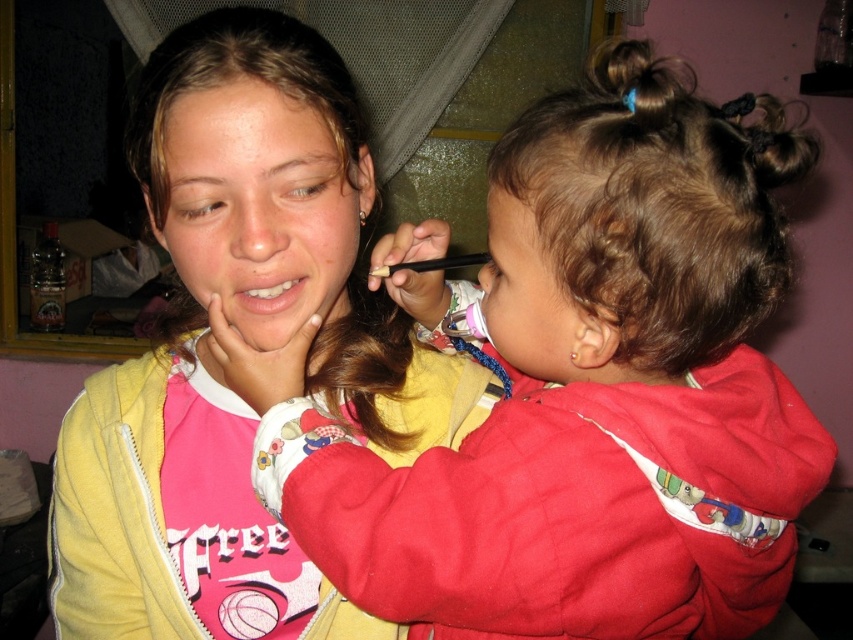
Question: Does yellow fleece jacket at upper left appear under brown hair at upper left?

Choices:
 (A) yes
 (B) no

Answer: (A)

Question: Is brown hair at upper center wider than brown hair at upper left?

Choices:
 (A) no
 (B) yes

Answer: (A)

Question: Among these points, which one is farthest from the camera?

Choices:
 (A) (181, 340)
 (B) (202, 292)

Answer: (A)

Question: Estimate the real-world distances between objects in this image. Which object is closer to the matte pink lips at center?

Choices:
 (A) brown shiny hair at upper left
 (B) matte skin face at upper center

Answer: (B)

Question: Which point is closer to the camera?

Choices:
 (A) brown hair at upper left
 (B) yellow fleece jacket at upper left

Answer: (B)

Question: Does soft pink hoodie at center lie behind yellow fleece jacket at upper left?

Choices:
 (A) yes
 (B) no

Answer: (B)